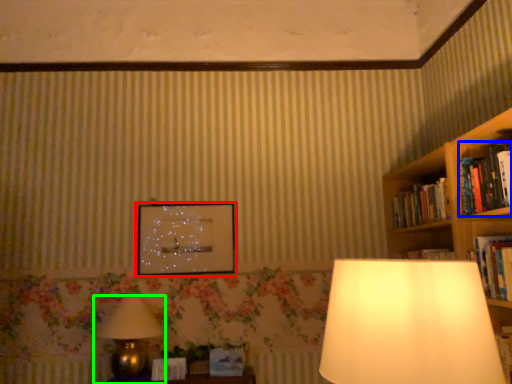
Question: Based on their relative distances, which object is nearer to picture frame (highlighted by a red box)? Choose from book (highlighted by a blue box) and lamp (highlighted by a green box).

Choices:
 (A) book
 (B) lamp

Answer: (B)